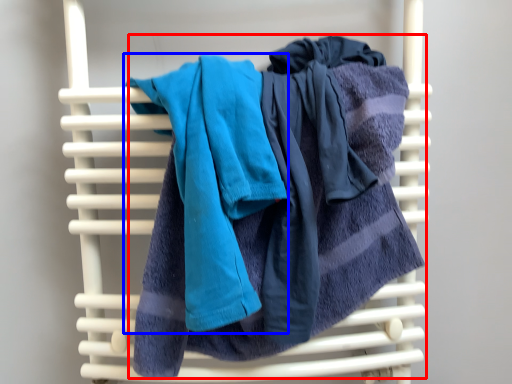
Question: Which object appears farthest to the camera in this image, towel (highlighted by a red box) or towel (highlighted by a blue box)?

Choices:
 (A) towel
 (B) towel

Answer: (A)